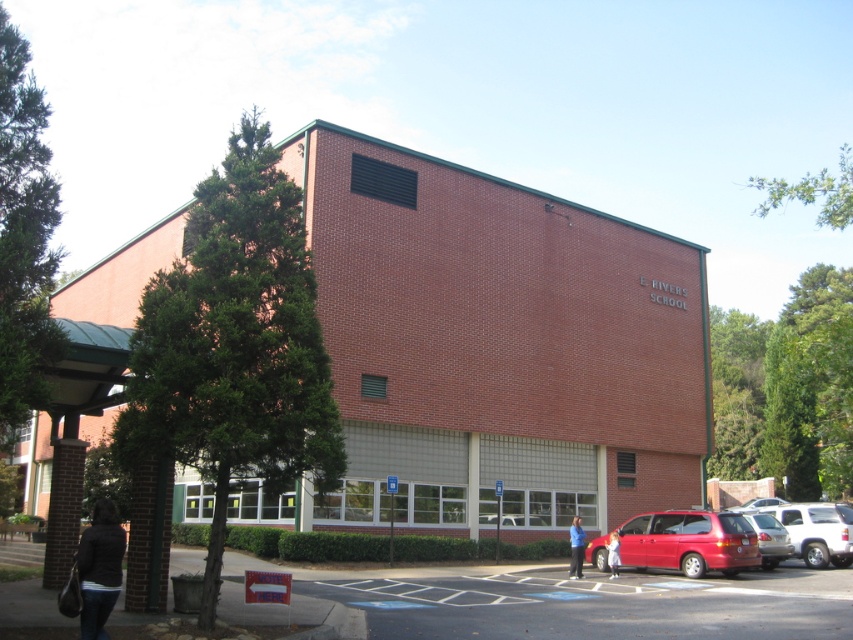
You are a parent arriving at E. RIVERS SCHOOL to pick up your child. You see the dark gray jacket at lower left and the matte red van at center. Which object is closer to the school entrance?

The dark gray jacket at lower left is shorter than the matte red van at center, so the dark gray jacket at lower left is closer to the school entrance since it is positioned lower in the image.

You are a photographer trying to capture a shot of the dark gray jacket at lower left and the light brown hair at center. Can you see both subjects clearly in the same frame without moving your camera?

The dark gray jacket at lower left is positioned over the light brown hair at center, so the jacket may block part of the hair from view, making it difficult to see both clearly in the same frame without moving the camera.

You are a visitor arriving at E. RIVERS SCHOOL. You see a dark gray jacket at lower left and a matte red van at center. Which object is closer to you from your vantage point?

The dark gray jacket at lower left is closer to you because it is in front of the matte red van at center.